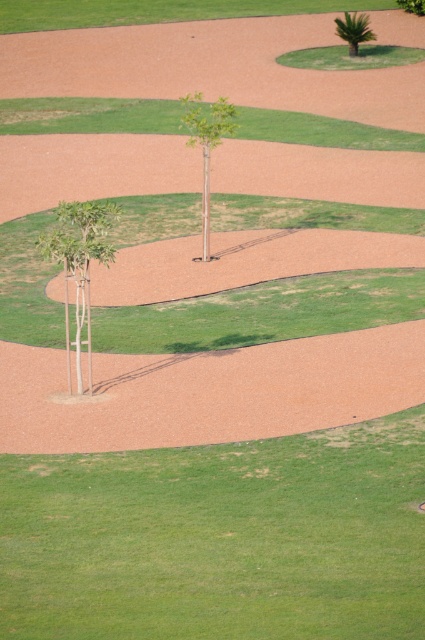
Which is above, green matte tree at lower left or green matte tree at center?

Positioned higher is green matte tree at center.

Can you confirm if green matte tree at lower left is positioned above green matte tree at center?

No, green matte tree at lower left is not above green matte tree at center.

This screenshot has height=640, width=425. Describe the element at coordinates (79, 264) in the screenshot. I see `green matte tree at lower left` at that location.

You are a GUI agent. You are given a task and a screenshot of the screen. Output one action in this format:
    pyautogui.click(x=<x>, y=<y>)
    Task: Click on the green matte tree at lower left
    The width and height of the screenshot is (425, 640).
    Given the screenshot: What is the action you would take?
    pyautogui.click(x=79, y=264)

Does green matte tree at center appear on the left side of green leafy tree at upper center?

Correct, you'll find green matte tree at center to the left of green leafy tree at upper center.

Consider the image. Which is above, green matte tree at center or green leafy tree at upper center?

green leafy tree at upper center is above.

Between point (215, 104) and point (414, 3), which one is positioned in front?

Point (215, 104) is more forward.

The width and height of the screenshot is (425, 640). What are the coordinates of `green matte tree at center` in the screenshot? It's located at (206, 145).

Is the position of green matte tree at center less distant than that of green leafy palm at upper center?

Yes.

Which is in front, point (197, 93) or point (362, 35)?

Point (197, 93) is more forward.

Find the location of a particular element. This screenshot has height=640, width=425. green matte tree at center is located at coordinates (206, 145).